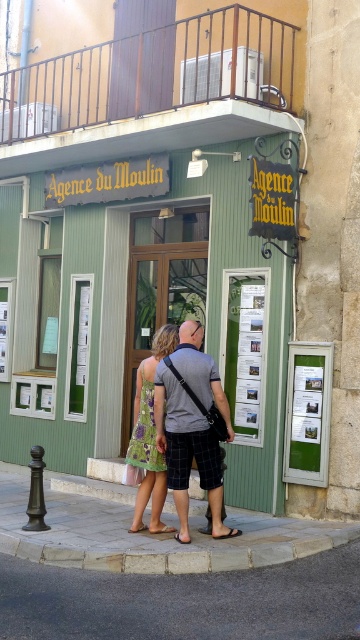
Between gray cotton t-shirt at center and green floral dress at center, which one is positioned higher?

gray cotton t-shirt at center

Is gray cotton t-shirt at center smaller than green floral dress at center?

Actually, gray cotton t-shirt at center might be larger than green floral dress at center.

Does point (217, 538) come closer to viewer compared to point (145, 376)?

That is True.

Image resolution: width=360 pixels, height=640 pixels. What are the coordinates of `gray cotton t-shirt at center` in the screenshot? It's located at (186, 451).

Is point (28, 480) in front of point (176, 324)?

That is False.

Is gray stone pavement at lower center positioned at the back of green floral dress at center?

No, it is not.

Locate an element on the screen. The width and height of the screenshot is (360, 640). gray stone pavement at lower center is located at coordinates (150, 538).

Locate an element on the screen. This screenshot has height=640, width=360. gray stone pavement at lower center is located at coordinates (150, 538).

Is gray concrete pavement at lower center thinner than green floral dress at center?

In fact, gray concrete pavement at lower center might be wider than green floral dress at center.

Is point (178, 595) positioned in front of point (171, 529)?

Yes, it is.

Image resolution: width=360 pixels, height=640 pixels. Describe the element at coordinates (183, 602) in the screenshot. I see `gray concrete pavement at lower center` at that location.

You are a GUI agent. You are given a task and a screenshot of the screen. Output one action in this format:
    pyautogui.click(x=<x>, y=<y>)
    Task: Click on the gray concrete pavement at lower center
    
    Given the screenshot: What is the action you would take?
    pyautogui.click(x=183, y=602)